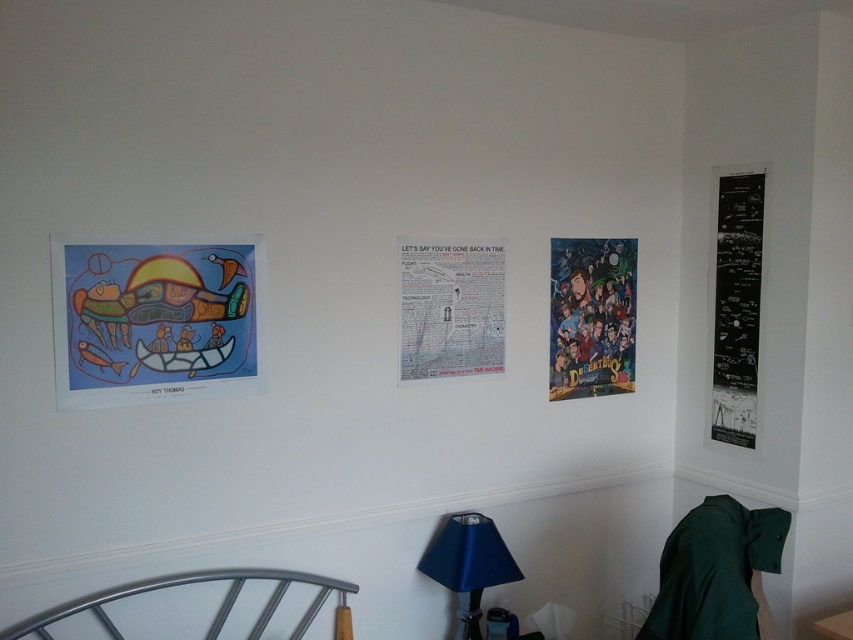
Question: Which point appears closest to the camera in this image?

Choices:
 (A) (463, 538)
 (B) (242, 317)
 (C) (614, 240)
 (D) (442, 308)

Answer: (B)

Question: Does matte paper poster at upper left appear on the right side of silver metallic bed at lower left?

Choices:
 (A) no
 (B) yes

Answer: (A)

Question: Which point appears farthest from the camera in this image?

Choices:
 (A) (718, 372)
 (B) (73, 252)

Answer: (A)

Question: Is matte paper poster at upper left thinner than colorful paper poster at center right?

Choices:
 (A) no
 (B) yes

Answer: (A)

Question: Which point is farther to the camera?

Choices:
 (A) (601, 305)
 (B) (502, 563)

Answer: (A)

Question: From the image, what is the correct spatial relationship of colorful paper poster at center right in relation to blue fabric lampshade at lower center?

Choices:
 (A) above
 (B) below

Answer: (A)